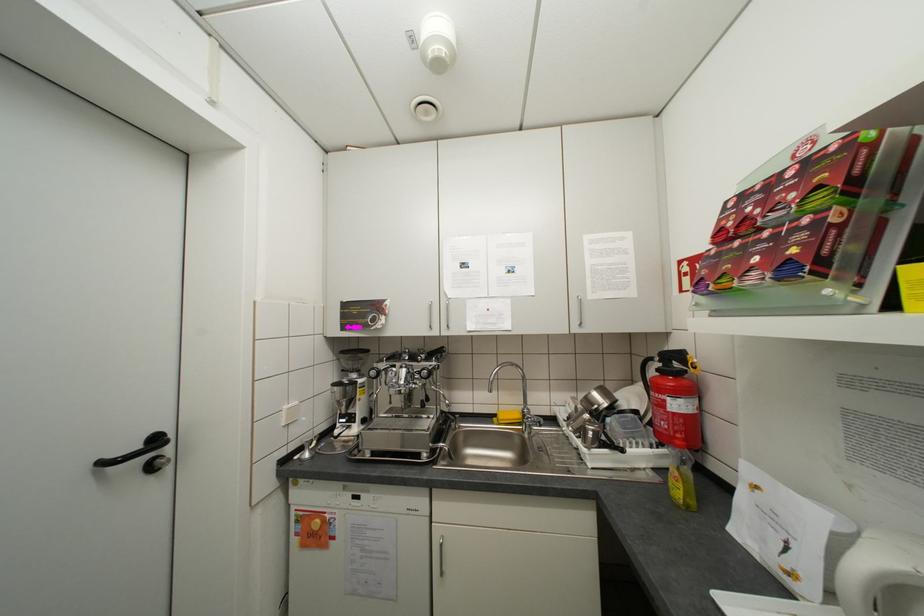
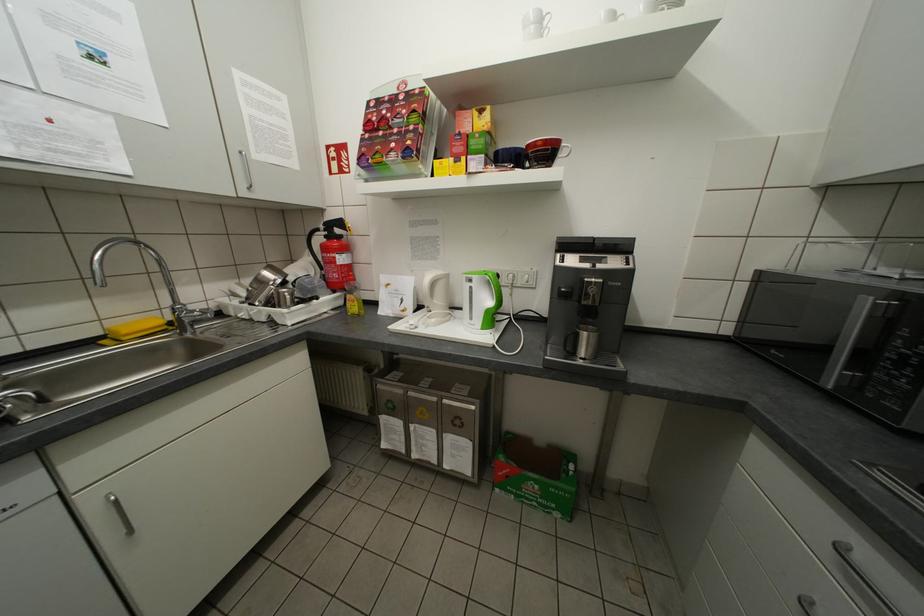
Where in the second image is the point corresponding to point 660,359 from the first image?

(325, 230)